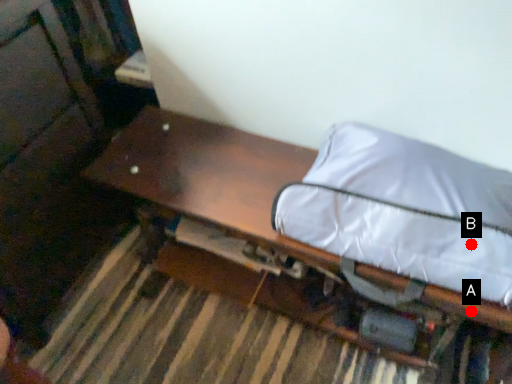
Question: Two points are circled on the image, labeled by A and B beside each circle. Which point appears closest to the camera in this image?

Choices:
 (A) A is closer
 (B) B is closer

Answer: (B)